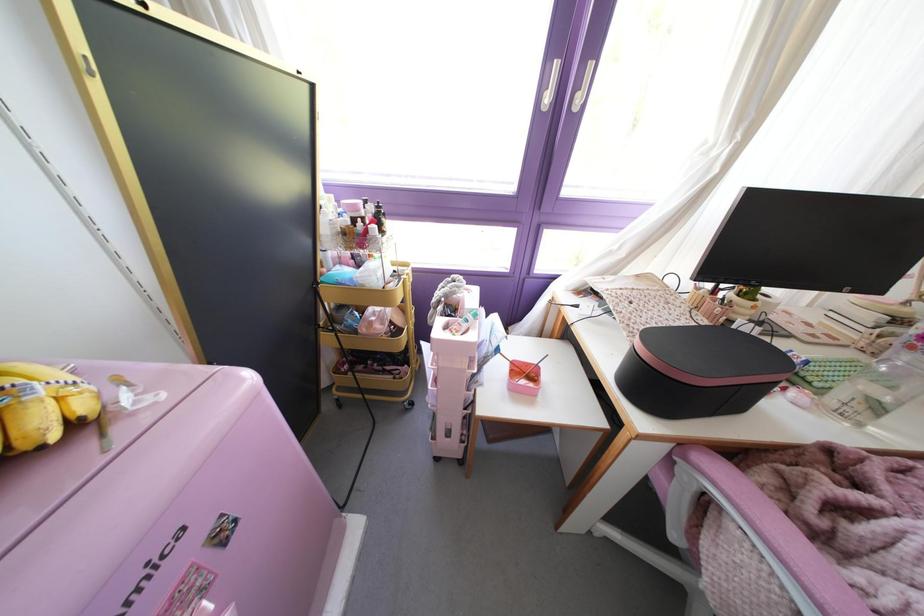
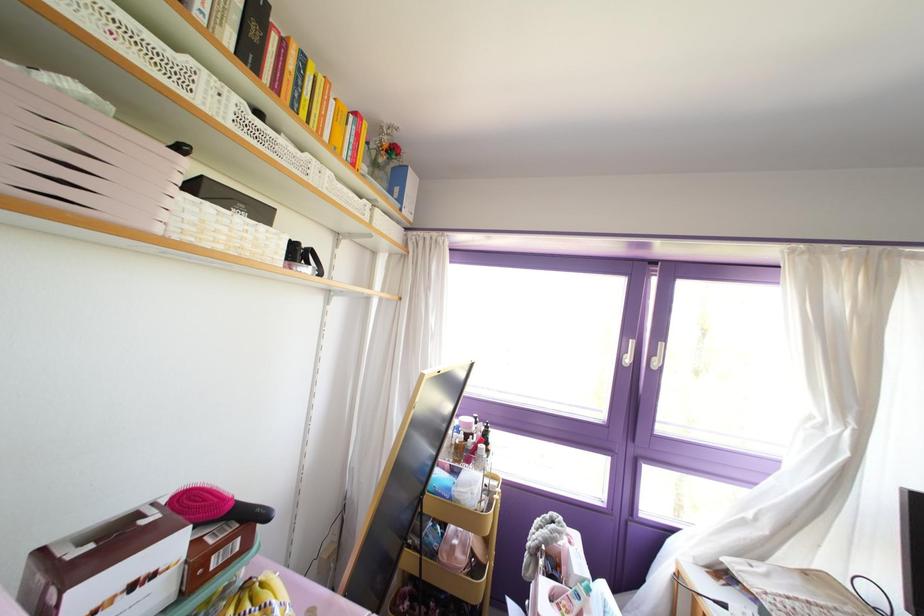
Find the pixel in the second image that matches pixel 546 99 in the first image.

(626, 360)